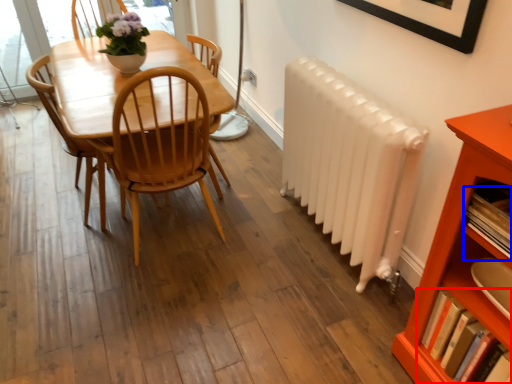
Question: Which of the following is the farthest to the observer, book (highlighted by a red box) or book (highlighted by a blue box)?

Choices:
 (A) book
 (B) book

Answer: (A)